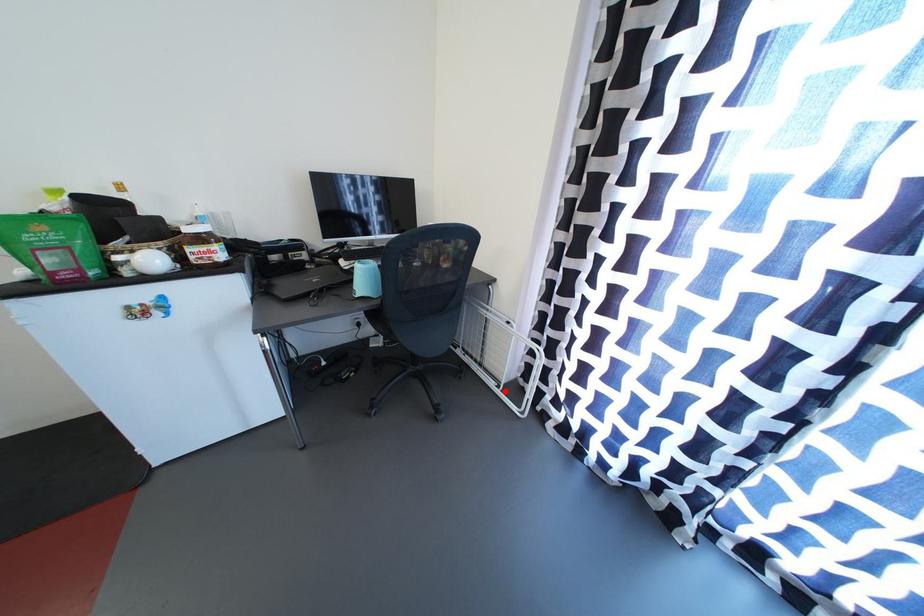
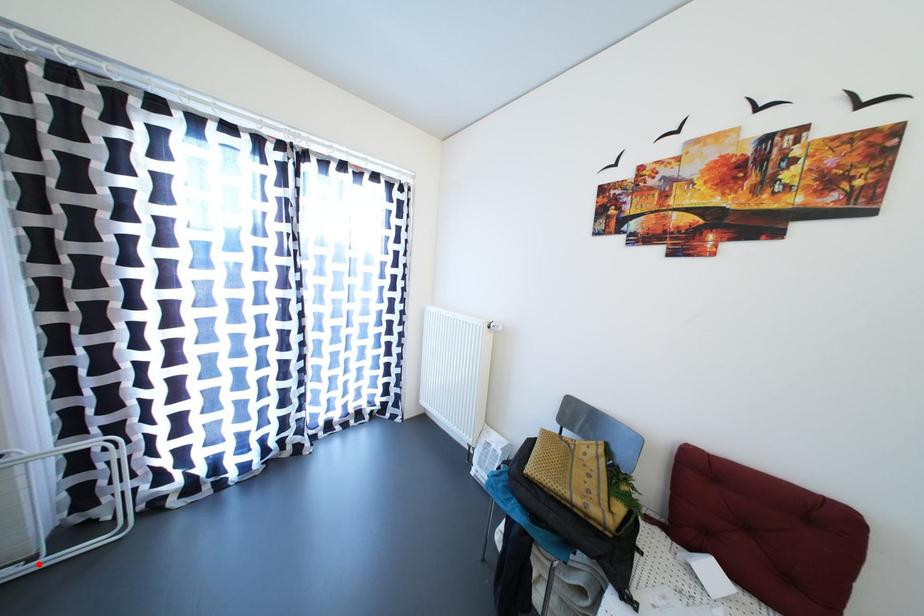
I am providing you with two images of the same scene from different viewpoints. A red point is marked on the first image and another point is marked on the second image. Is the red point in image1 aligned with the point shown in image2?

Yes